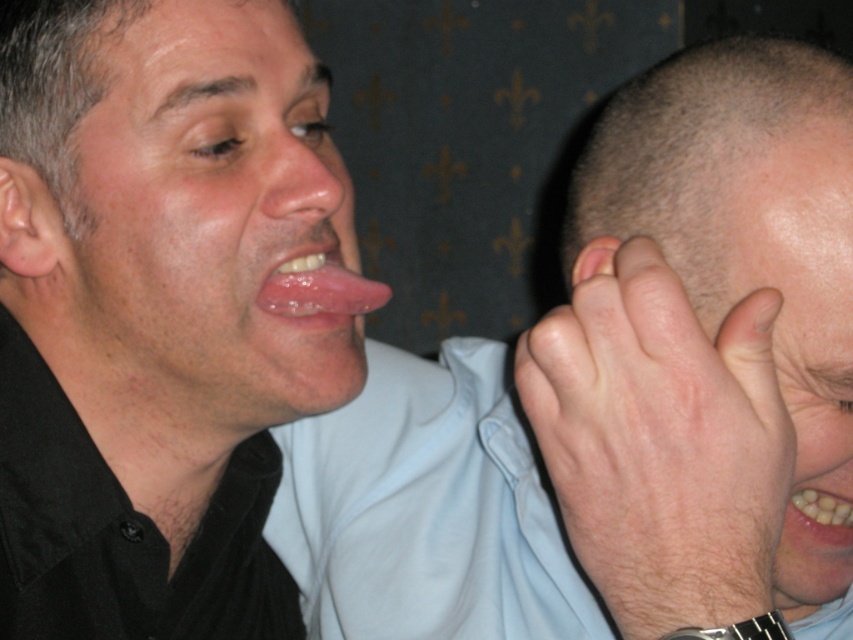
Consider the image. You are a photographer standing 20 inches away from the matte skin hand at center. Can you take a clear photo of it without moving closer?

The matte skin hand at center is 17.33 inches away from the camera. Since you are standing 20 inches away, you are further than the hand, so you can take a clear photo without moving closer.

You are a photographer trying to capture a candid shot of the smooth skin nose at center without the dry skin hand at right blocking it. Can you angle your camera to the left to avoid the hand?

The dry skin hand at right is larger in size than the smooth skin nose at center, so angling the camera to the left may help avoid the obstruction caused by the larger hand.

You are a photographer trying to capture a candid shot of the light brown hair at right and the matte skin hand at center. Since you want to ensure both elements are in focus, you need to know which one is taller. Can you determine which object is taller?

The matte skin hand at center is taller than the light brown hair at right according to the description, so the photographer should focus on the matte skin hand at center first as it is taller.